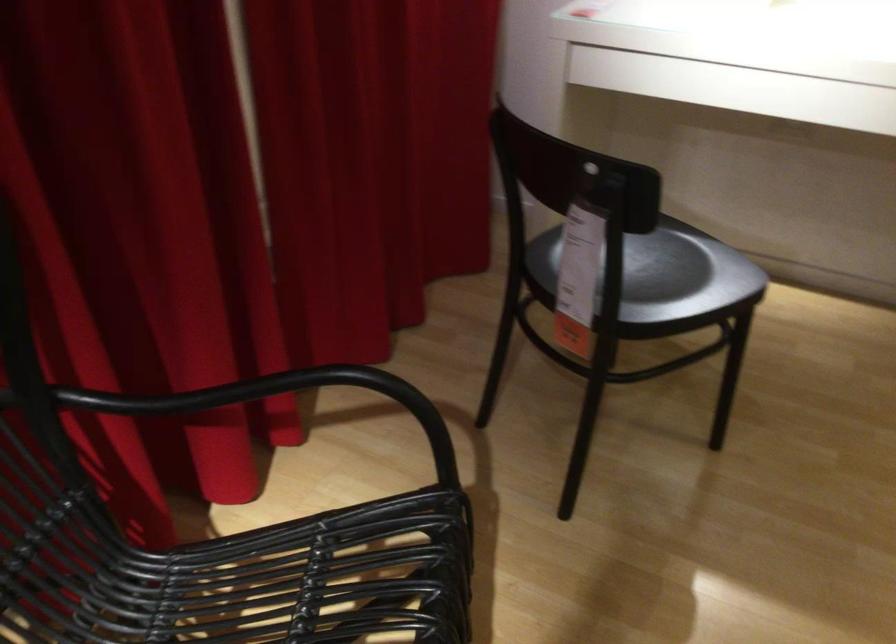
You are a GUI agent. You are given a task and a screenshot of the screen. Output one action in this format:
    pyautogui.click(x=<x>, y=<y>)
    Task: Click on the black chair sitting surface
    The width and height of the screenshot is (896, 644).
    Given the screenshot: What is the action you would take?
    pyautogui.click(x=218, y=518)